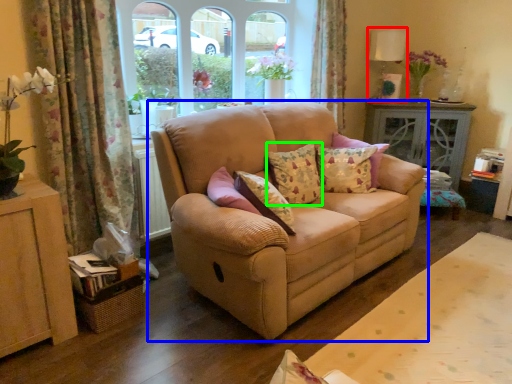
Question: Which is farther away from lamp (highlighted by a red box)? studio couch (highlighted by a blue box) or pillow (highlighted by a green box)?

Choices:
 (A) studio couch
 (B) pillow

Answer: (A)